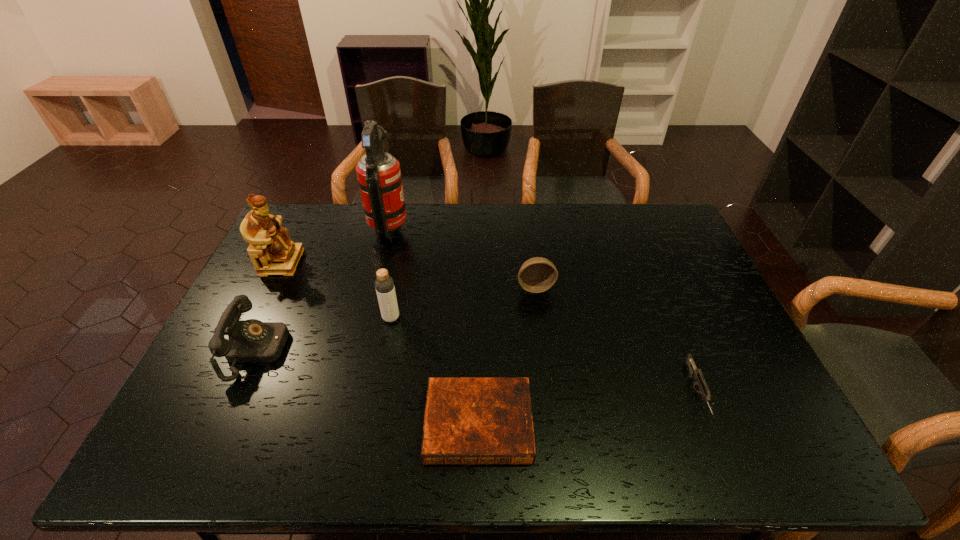
This screenshot has width=960, height=540. I want to click on vacant point located between the farthest object and the fifth shortest object, so click(x=391, y=273).

Where is `vacant space that is in between the bowl and the fire extinguisher`? Image resolution: width=960 pixels, height=540 pixels. vacant space that is in between the bowl and the fire extinguisher is located at coordinates (463, 257).

Where is `free spot between the farthest object and the gun`? free spot between the farthest object and the gun is located at coordinates (543, 310).

Identify the location of empty space that is in between the shortest object and the sixth shortest object. (380, 343).

Identify which object is the fourth closest to the telephone. Please provide its 2D coordinates. Your answer should be formatted as a tuple, i.e. [(x, y)], where the tuple contains the x and y coordinates of a point satisfying the conditions above.

[(467, 420)]

Select which object is the third closest to the bottle. Please provide its 2D coordinates. Your answer should be formatted as a tuple, i.e. [(x, y)], where the tuple contains the x and y coordinates of a point satisfying the conditions above.

[(379, 176)]

Identify the location of free location that satisfies the following two spatial constraints: 1. on the front-facing side of the sixth shortest object; 2. on the back side of the bottle. (254, 318).

The width and height of the screenshot is (960, 540). I want to click on free spot that satisfies the following two spatial constraints: 1. on the front label side of the tallest object; 2. on the left side of the third farthest object, so click(x=375, y=287).

Image resolution: width=960 pixels, height=540 pixels. I want to click on free location that satisfies the following two spatial constraints: 1. on the front label side of the farthest object; 2. on the back side of the third farthest object, so click(375, 287).

Find the location of `vacant area that satisfies the following two spatial constraints: 1. on the back side of the bowl; 2. on the front label side of the farthest object`. vacant area that satisfies the following two spatial constraints: 1. on the back side of the bowl; 2. on the front label side of the farthest object is located at coordinates [x=528, y=228].